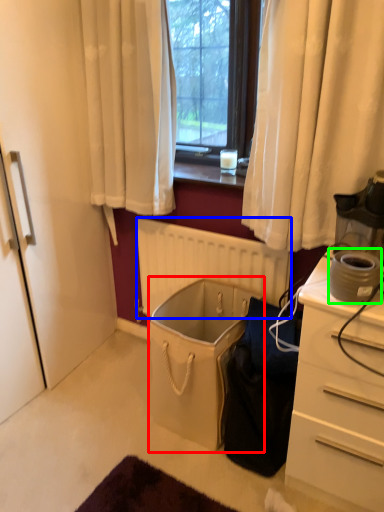
Question: Based on their relative distances, which object is nearer to laundry basket (highlighted by a red box)? Choose from radiator (highlighted by a blue box) and appliance (highlighted by a green box).

Choices:
 (A) radiator
 (B) appliance

Answer: (A)